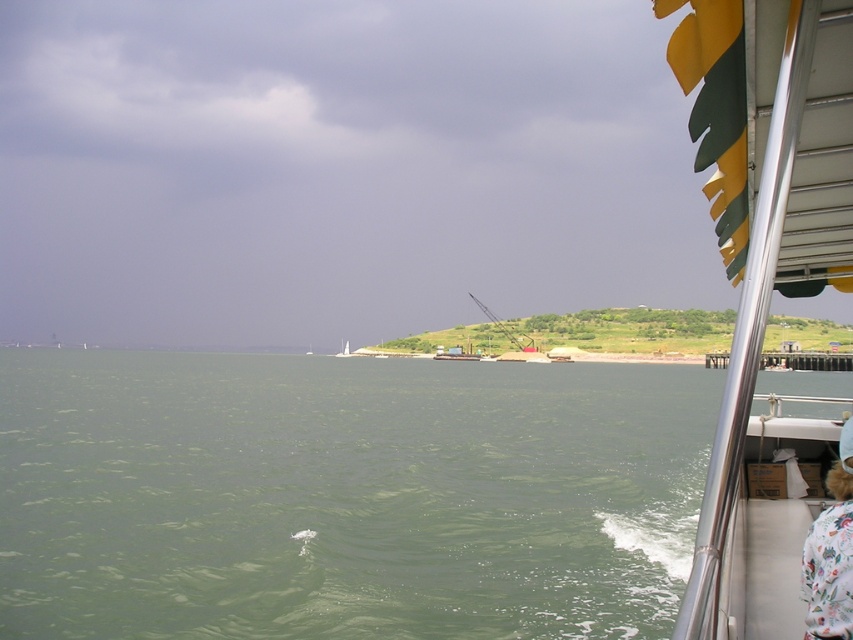
Which is behind, point (456, 531) or point (844, 556)?

Positioned behind is point (456, 531).

Between point (175, 356) and point (828, 518), which one is positioned behind?

Point (175, 356)

Where is `green water at lower left`? green water at lower left is located at coordinates (345, 496).

Can you confirm if green water at lower left is positioned to the left of metallic silver boat at right?

Incorrect, green water at lower left is not on the left side of metallic silver boat at right.

Who is more forward, (210,429) or (759,170)?

Positioned in front is point (759,170).

Is point (624, 625) in front of point (831, 104)?

No, (624, 625) is behind (831, 104).

Where is `green water at lower left`? The width and height of the screenshot is (853, 640). green water at lower left is located at coordinates (345, 496).

Locate an element on the screen. This screenshot has height=640, width=853. green water at lower left is located at coordinates (345, 496).

Is point (21, 552) less distant than point (341, 356)?

That is True.

I want to click on green water at lower left, so tap(345, 496).